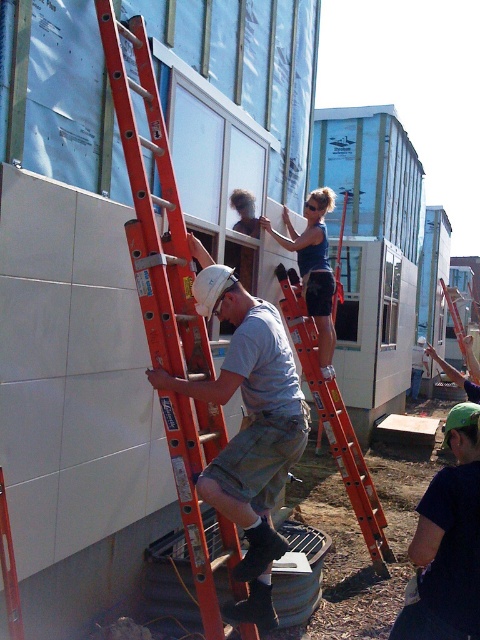
Between orange fiberglass ladder at left and matte blue tank top at upper center, which one is positioned lower?

orange fiberglass ladder at left is below.

Which of these two, orange fiberglass ladder at left or matte blue tank top at upper center, stands taller?

orange fiberglass ladder at left is taller.

Does point (173, 429) come behind point (305, 246)?

No.

Where is `orange fiberglass ladder at left`? orange fiberglass ladder at left is located at coordinates (153, 212).

Can you confirm if orange fiberglass ladder at center is positioned to the right of matte blue tank top at upper center?

Yes, orange fiberglass ladder at center is to the right of matte blue tank top at upper center.

Can you confirm if orange fiberglass ladder at center is bigger than matte blue tank top at upper center?

Correct, orange fiberglass ladder at center is larger in size than matte blue tank top at upper center.

At what (x,y) coordinates should I click in order to perform the action: click on orange fiberglass ladder at center. Please return your answer as a coordinate pair (x, y). Looking at the image, I should click on (335, 422).

At what (x,y) coordinates should I click in order to perform the action: click on orange fiberglass ladder at center. Please return your answer as a coordinate pair (x, y). This screenshot has width=480, height=640. Looking at the image, I should click on (335, 422).

Is orange fiberglass ladder at left below white matte hard hat at center?

Actually, orange fiberglass ladder at left is above white matte hard hat at center.

Does orange fiberglass ladder at left appear on the left side of white matte hard hat at center?

Yes, orange fiberglass ladder at left is to the left of white matte hard hat at center.

The height and width of the screenshot is (640, 480). What do you see at coordinates (153, 212) in the screenshot?
I see `orange fiberglass ladder at left` at bounding box center [153, 212].

Locate an element on the screen. This screenshot has width=480, height=640. orange fiberglass ladder at left is located at coordinates (153, 212).